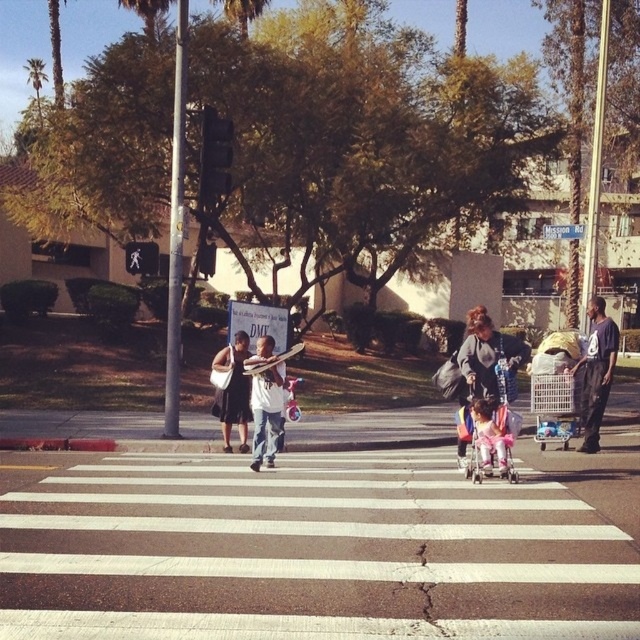
You are a delivery person trying to cross the street. You see the white asphalt crosswalk at center and the pink fabric baby carriage at center. Which object is closer to the left side of the street?

The white asphalt crosswalk at center is closer to the left side of the street because it is positioned to the left of the pink fabric baby carriage at center.

You are a pedestrian standing at the edge of the white asphalt crosswalk at center. You want to reach the green leafy palm tree at upper left. Which direction should you walk to get there?

The white asphalt crosswalk at center is positioned under the green leafy palm tree at upper left, so you should walk towards the upper left direction to reach it.

You are standing at the crosswalk and want to take a photo of both the point at coordinates point [33,456] and the point at coordinates point [480,481]. Which point should you focus on first to ensure both are in focus?

You should focus on the point at coordinates point [33,456] first because it is closer to the camera than the point at coordinates point [480,481], ensuring both are in focus.